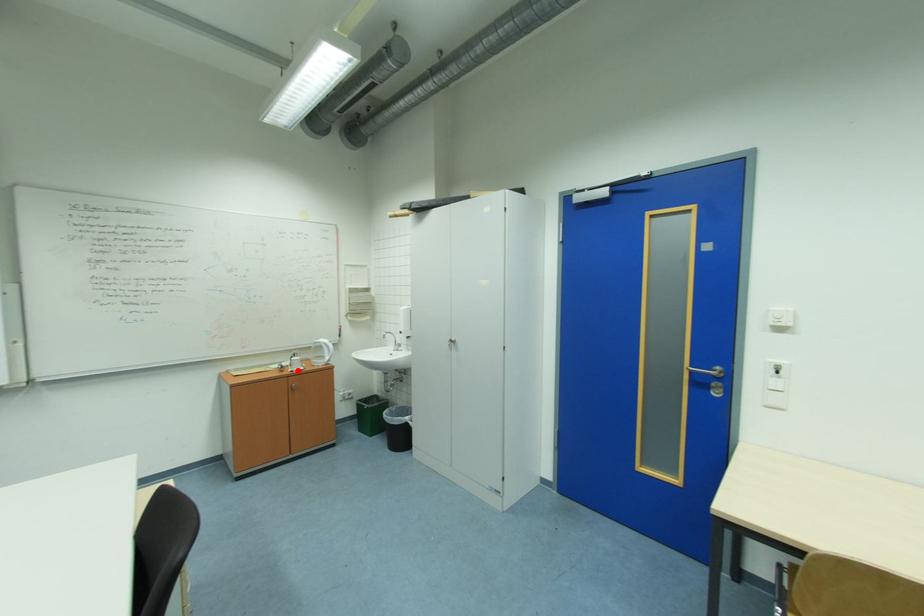
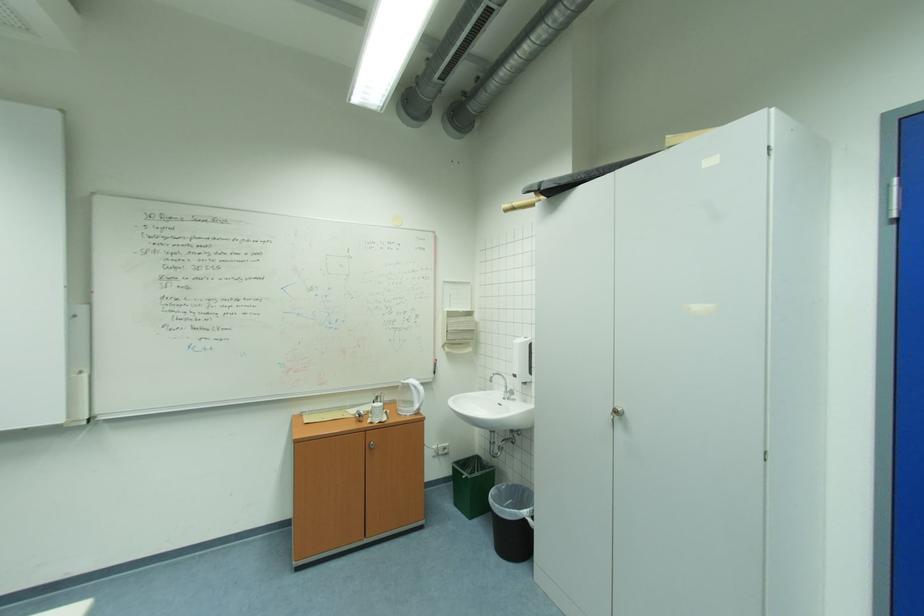
In the second image, find the point that corresponds to the highlighted location in the first image.

(377, 422)